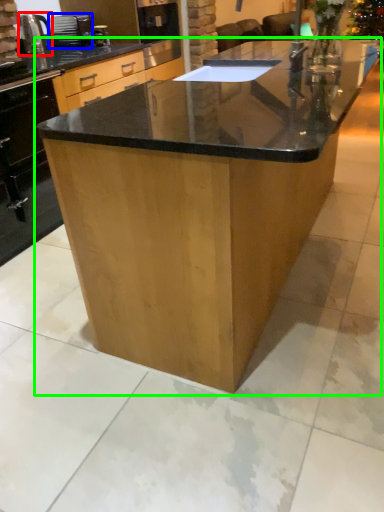
Question: Considering the real-world distances, which object is closest to kitchen appliance (highlighted by a red box)? appliance (highlighted by a blue box) or table (highlighted by a green box).

Choices:
 (A) appliance
 (B) table

Answer: (A)